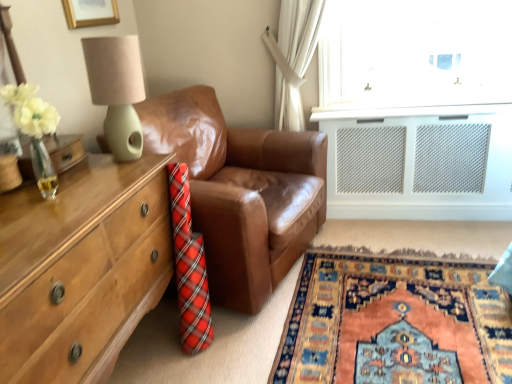
Where is `vacant point to the left of matte green lamp at upper left`? The image size is (512, 384). vacant point to the left of matte green lamp at upper left is located at coordinates (84, 168).